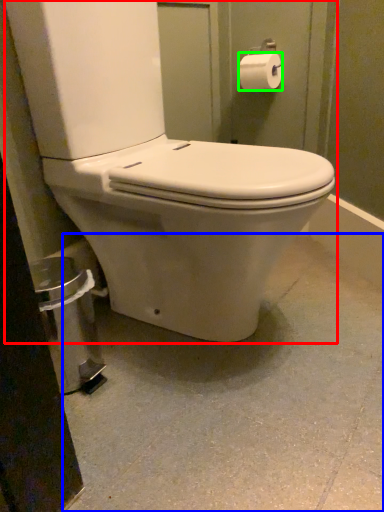
Question: Considering the real-world distances, which object is farthest from toilet (highlighted by a red box)? concrete (highlighted by a blue box) or toilet paper (highlighted by a green box)?

Choices:
 (A) concrete
 (B) toilet paper

Answer: (B)